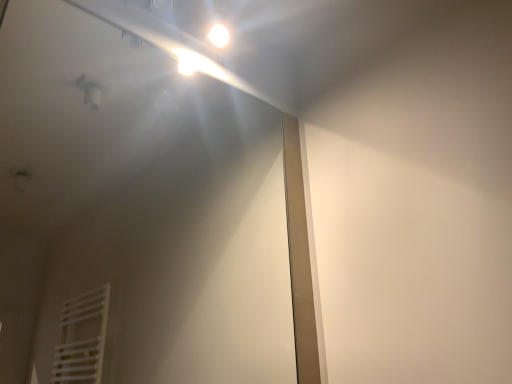
Describe the element at coordinates (135, 214) in the screenshot. I see `white glossy mirror at upper center` at that location.

Find the location of a particular element. white glossy mirror at upper center is located at coordinates (135, 214).

This screenshot has width=512, height=384. Identify the location of white glossy mirror at upper center. (135, 214).